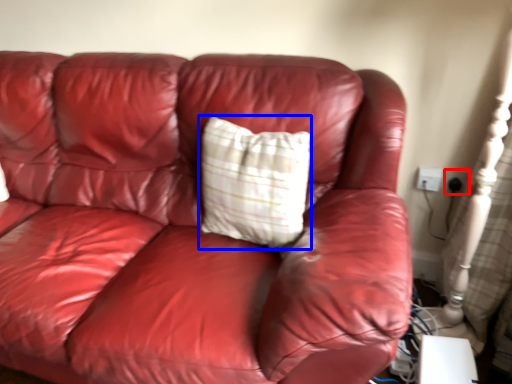
Question: Among these objects, which one is nearest to the camera, electric outlet (highlighted by a red box) or pillow (highlighted by a blue box)?

Choices:
 (A) electric outlet
 (B) pillow

Answer: (B)